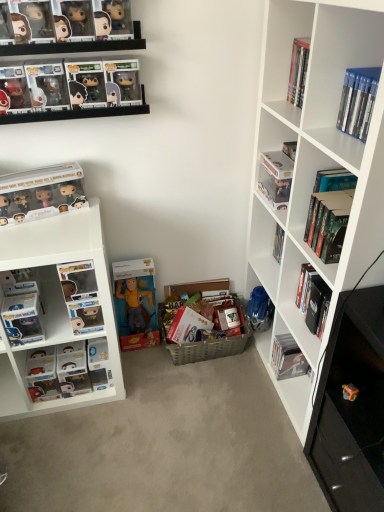
Locate an element on the screen. free space in front of matte plastic pop vinyl figure at lower left, placed as the 7th book when sorted from right to left is located at coordinates (68, 426).